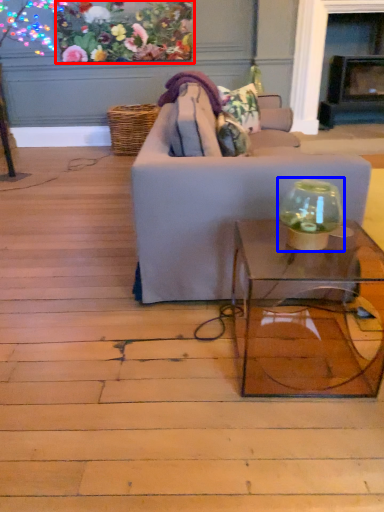
Question: Which object appears farthest to the camera in this image, floral arrangement (highlighted by a red box) or glass vase (highlighted by a blue box)?

Choices:
 (A) floral arrangement
 (B) glass vase

Answer: (A)